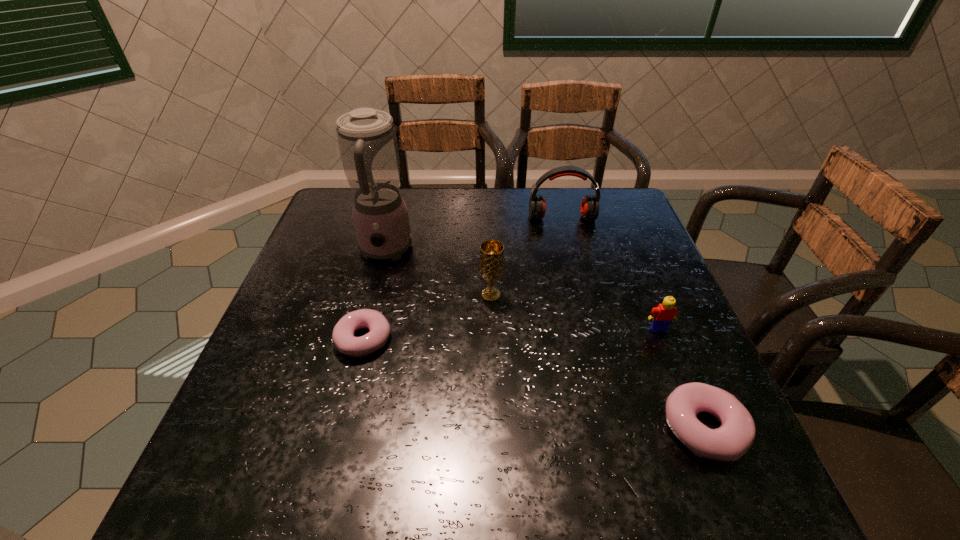
In the image, there is a desktop. Identify the location of blank space at the right edge. (641, 295).

Locate an element on the screen. vacant space at the near left corner of the desktop is located at coordinates (306, 429).

I want to click on vacant space at the far right corner, so click(x=581, y=198).

This screenshot has height=540, width=960. Identify the location of vacant space in between the nearest object and the earphone. (633, 323).

This screenshot has height=540, width=960. I want to click on unoccupied position between the taller doughnut and the earphone, so 633,323.

You are a GUI agent. You are given a task and a screenshot of the screen. Output one action in this format:
    pyautogui.click(x=<x>, y=<y>)
    Task: Click on the unoccupied position between the fourth nearest object and the farther doughnut
    
    Given the screenshot: What is the action you would take?
    pyautogui.click(x=427, y=317)

The image size is (960, 540). I want to click on vacant space that is in between the shorter doughnut and the earphone, so click(x=463, y=279).

I want to click on free spot between the earphone and the shorter doughnut, so click(463, 279).

This screenshot has height=540, width=960. Identify the location of free space between the tallest object and the Lego. click(522, 290).

This screenshot has height=540, width=960. In order to click on vacant space that's between the farthest object and the tallest object in this screenshot , I will do `click(473, 234)`.